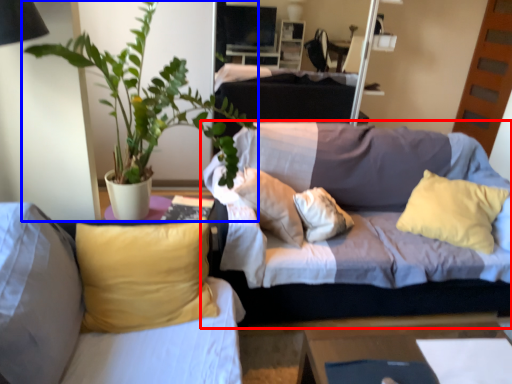
Question: Which of the following is the closest to the observer, studio couch (highlighted by a red box) or houseplant (highlighted by a blue box)?

Choices:
 (A) studio couch
 (B) houseplant

Answer: (B)